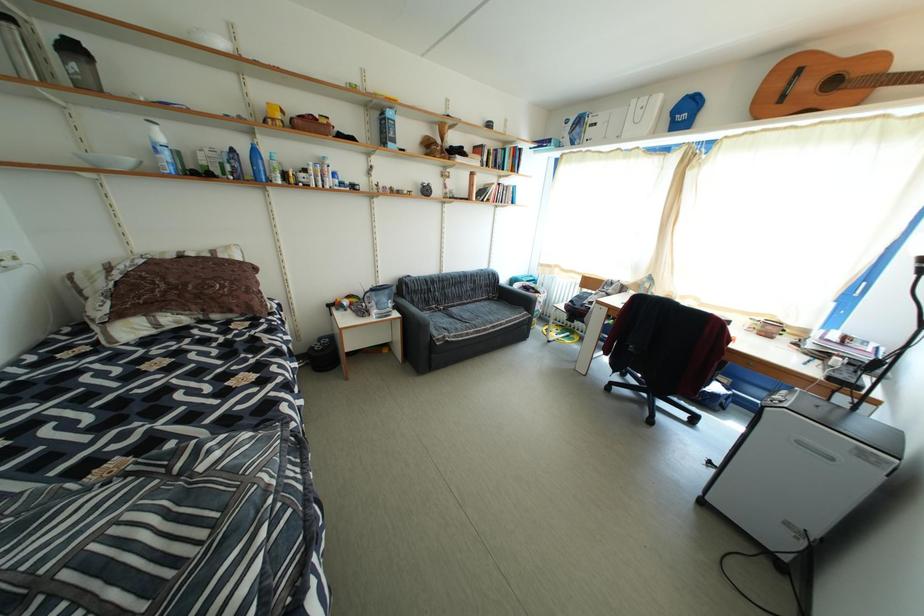
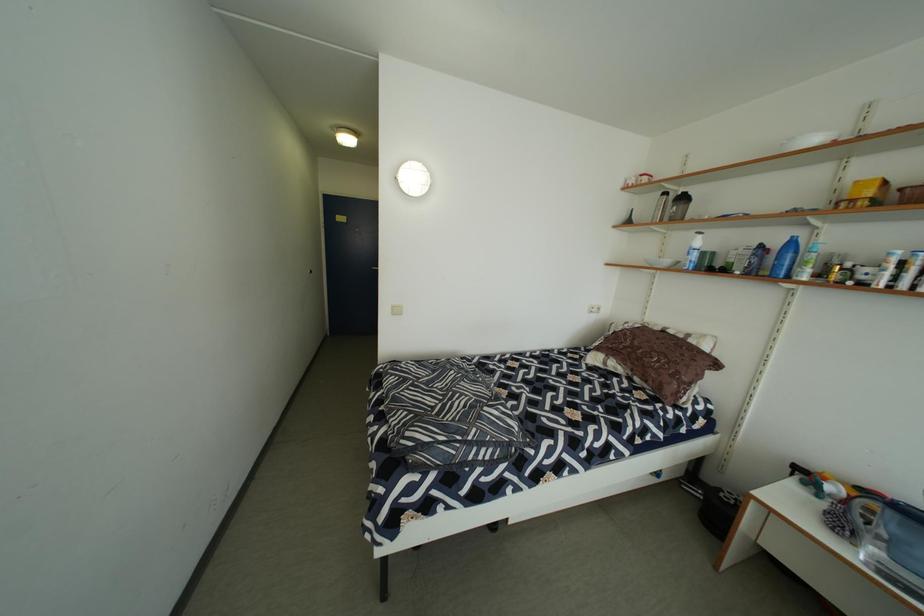
Question: The camera is either moving clockwise (left) or counter-clockwise (right) around the object. The first image is from the beginning of the video and the second image is from the end. Is the camera moving left or right when shooting the video?

Choices:
 (A) Left
 (B) Right

Answer: (B)